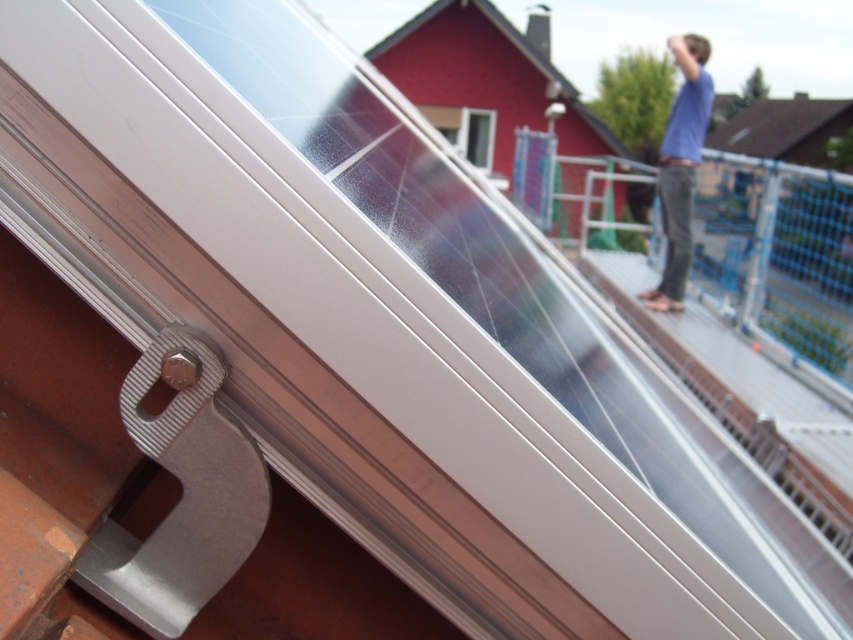
You are a window cleaner standing on a rooftop and see the blue cotton shirt at upper right. The safety regulations require that you must stay at least 5 meters away from any bystanders. Are you compliant with the safety regulations?

The blue cotton shirt at upper right is 4.70 meters away, which is less than the required 5 meters. Therefore, you are not compliant with the safety regulations.

In the scene shown: You are a delivery drone that needs to fly between the blue cotton shirt at upper right and the transparent glass window at upper center. Which object do you need to fly over to avoid collision?

The blue cotton shirt at upper right is taller than the transparent glass window at upper center, so the drone should fly over the blue cotton shirt at upper right to avoid collision.